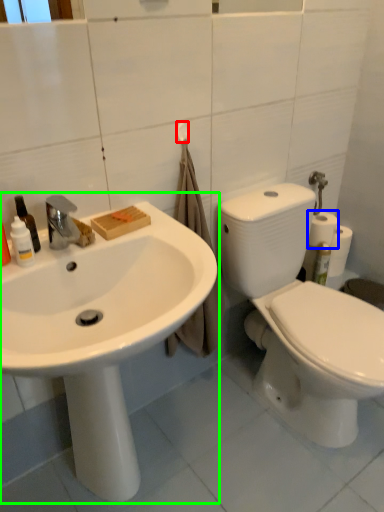
Question: Considering the real-world distances, which object is farthest from towel bar (highlighted by a red box)? toilet paper (highlighted by a blue box) or sink (highlighted by a green box)?

Choices:
 (A) toilet paper
 (B) sink

Answer: (A)